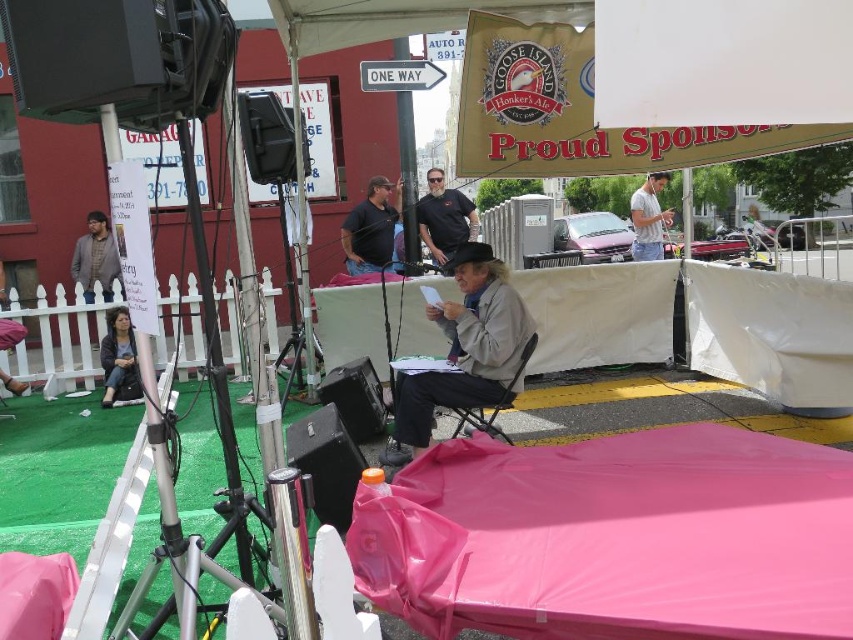
Question: Which object is farther from the camera taking this photo?

Choices:
 (A) matte black shirt at center
 (B) matte gray jacket at left

Answer: (B)

Question: Among these points, which one is nearest to the camera?

Choices:
 (A) (433, 232)
 (B) (90, 224)

Answer: (A)

Question: Among these objects, which one is farthest from the camera?

Choices:
 (A) gray woolen jacket at center
 (B) dark gray sweater at lower left
 (C) matte gray jacket at left

Answer: (C)

Question: Does gray woolen jacket at center appear under black matte shirt at center?

Choices:
 (A) no
 (B) yes

Answer: (B)

Question: Does black matte shirt at center appear under matte gray jacket at left?

Choices:
 (A) no
 (B) yes

Answer: (A)

Question: Is black matte shirt at center to the left of white cotton shirt at upper right from the viewer's perspective?

Choices:
 (A) no
 (B) yes

Answer: (B)